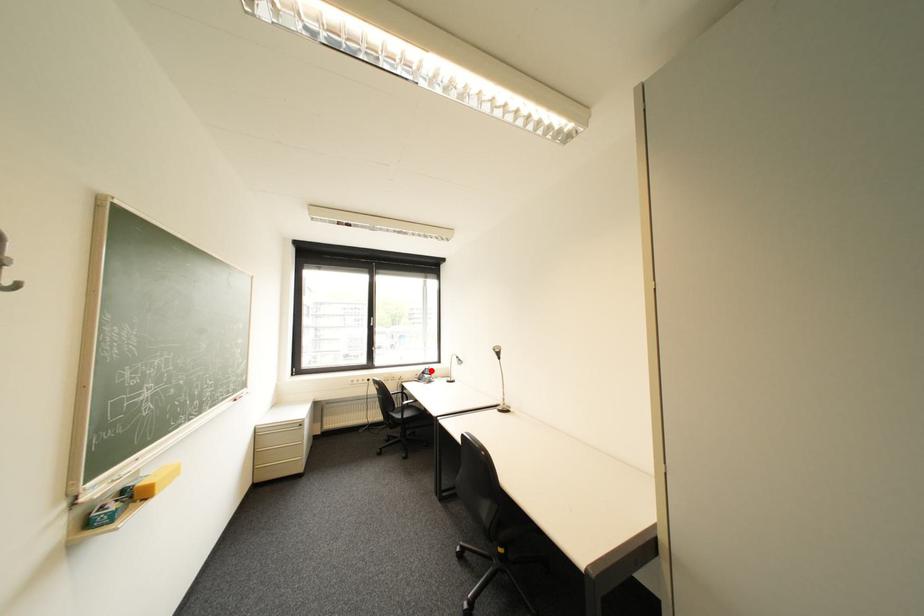
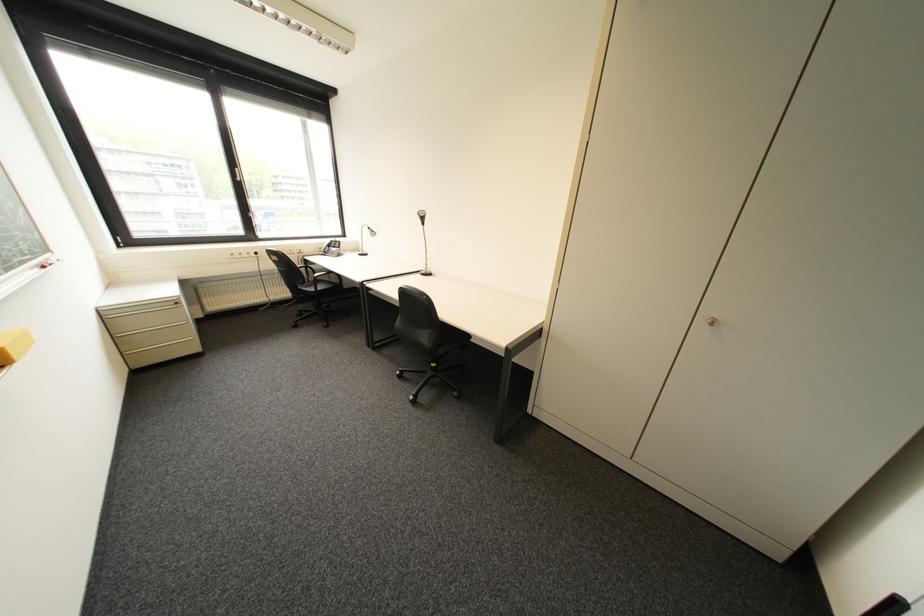
Question: A red point is marked in image1. In image2, is the corresponding 3D point closer to the camera or farther? Reply with the corresponding letter.

Choices:
 (A) The corresponding 3D point is closer.
 (B) The corresponding 3D point is farther.

Answer: (A)